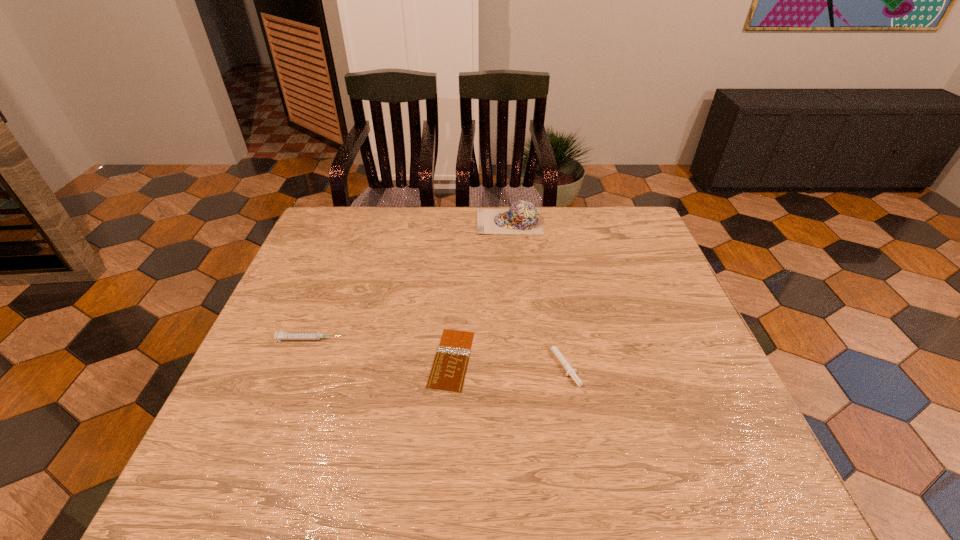
Locate an element on the screen. free spot located 0.120m on the front, side, and top of the farthest object is located at coordinates (440, 222).

Where is `free space located at the needle end of the third shortest object`? Image resolution: width=960 pixels, height=540 pixels. free space located at the needle end of the third shortest object is located at coordinates (392, 339).

This screenshot has height=540, width=960. Identify the location of free space located on the back of the third tallest object. (544, 261).

Find the location of a particular element. This screenshot has width=960, height=540. vacant space located 0.350m on the back of the chocolate bar is located at coordinates (459, 245).

Where is `object positioned at the far edge`? The height and width of the screenshot is (540, 960). object positioned at the far edge is located at coordinates (523, 217).

This screenshot has width=960, height=540. Identify the location of object that is positioned at the left edge. (281, 335).

At what (x,y) coordinates should I click in order to perform the action: click on vacant space at the far edge of the desktop. Please return your answer as a coordinate pair (x, y). Looking at the image, I should click on (578, 208).

I want to click on free spot at the near edge of the desktop, so click(430, 468).

The image size is (960, 540). In order to click on free region at the left edge in this screenshot , I will do pyautogui.click(x=252, y=445).

In the image, there is a desktop. In order to click on free space at the right edge in this screenshot , I will do `click(629, 299)`.